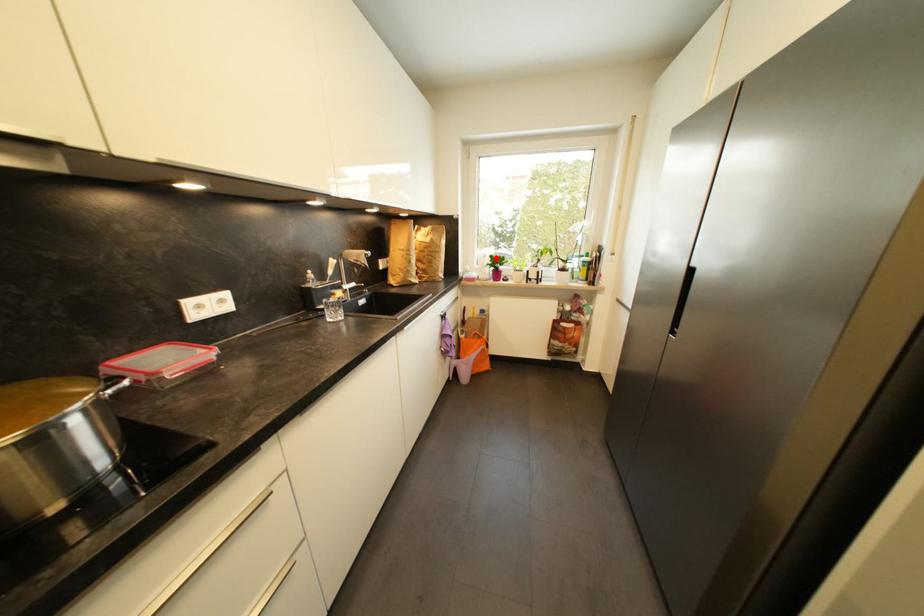
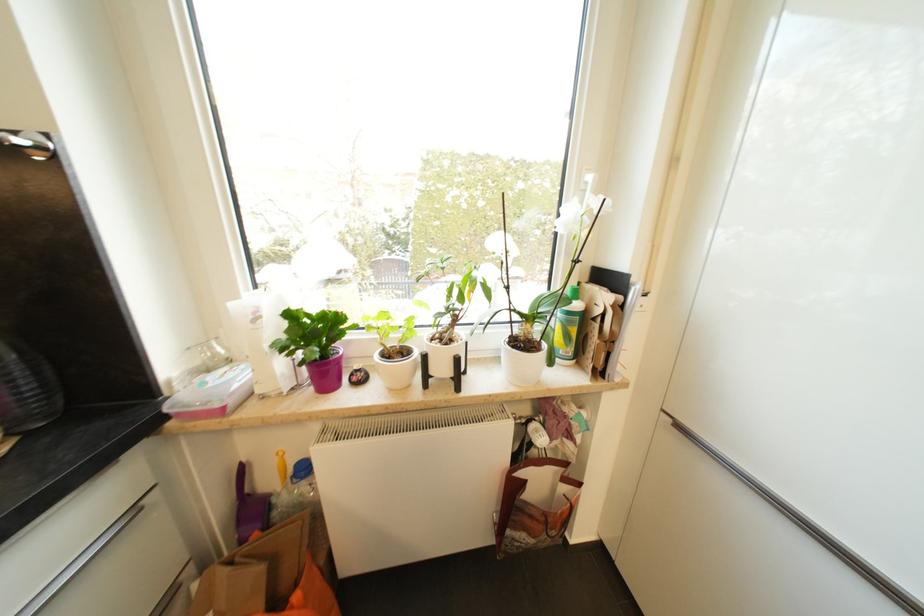
Question: I am providing you with two images of the same scene from different viewpoints. A red point is marked on the first image. Is the red point's position out of view in image 2?

Choices:
 (A) Yes
 (B) No

Answer: (B)